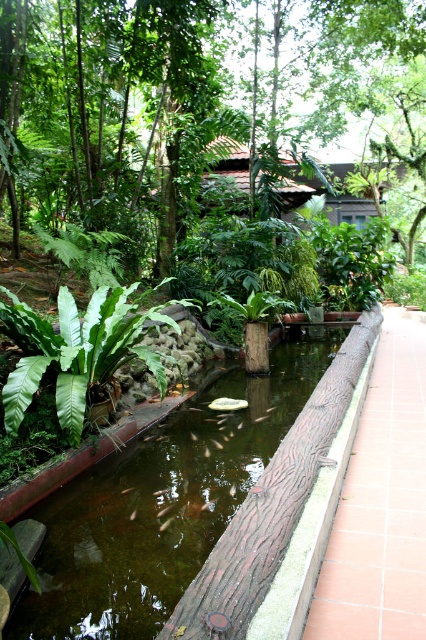
Question: Considering the relative positions of clear water at pond center and green leafy fern at center-left in the image provided, where is clear water at pond center located with respect to green leafy fern at center-left?

Choices:
 (A) below
 (B) above

Answer: (A)

Question: Which object is farther from the camera taking this photo?

Choices:
 (A) brown textured path at right
 (B) green leafy tree at center

Answer: (B)

Question: Can you confirm if green leafy tree at center is positioned above brown textured path at right?

Choices:
 (A) no
 (B) yes

Answer: (B)

Question: Among these objects, which one is farthest from the camera?

Choices:
 (A) clear water at pond center
 (B) green leafy tree at center

Answer: (B)

Question: Among these points, which one is nearest to the camera?

Choices:
 (A) (46, 365)
 (B) (138, 604)
 (C) (379, 544)
 (D) (43, 154)

Answer: (B)

Question: From the image, what is the correct spatial relationship of clear water at pond center in relation to brown textured path at right?

Choices:
 (A) below
 (B) above

Answer: (A)